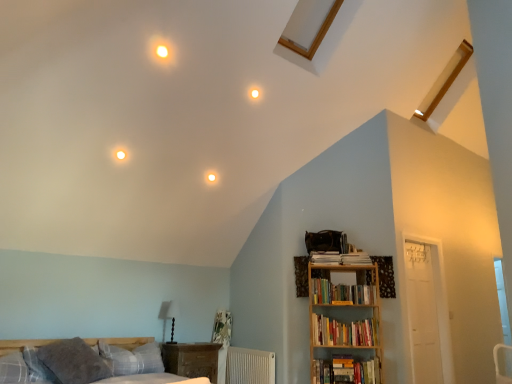
What do you see at coordinates (98, 366) in the screenshot? I see `plaid fabric bed at lower left` at bounding box center [98, 366].

Locate an element on the screen. Image resolution: width=512 pixels, height=384 pixels. matte white light bulb at upper center is located at coordinates (211, 177).

What do you see at coordinates (169, 315) in the screenshot?
I see `white matte table lamp at center` at bounding box center [169, 315].

What do you see at coordinates (344, 332) in the screenshot?
I see `hardcover books at right, marked as the second book in a top-to-bottom arrangement` at bounding box center [344, 332].

You are a GUI agent. You are given a task and a screenshot of the screen. Output one action in this format:
    pyautogui.click(x=<x>, y=<y>)
    Task: Click on the hardcover books at right, the third book viewed from the top
    This screenshot has width=512, height=384.
    Given the screenshot: What is the action you would take?
    coord(347,372)

Is white textured radiator at lower center to the left or to the right of gray soft pillow at lower left, the first pillow when ordered from right to left, in the image?

Clearly, white textured radiator at lower center is on the right of gray soft pillow at lower left, the first pillow when ordered from right to left, in the image.

Can you confirm if white textured radiator at lower center is shorter than gray soft pillow at lower left, the first pillow when ordered from right to left?

Incorrect, the height of white textured radiator at lower center does not fall short of that of gray soft pillow at lower left, the first pillow when ordered from right to left.

Is point (230, 359) closer to viewer compared to point (56, 343)?

No, (230, 359) is further to viewer.

Considering the sizes of white textured radiator at lower center and gray soft pillow at lower left, the first pillow when ordered from right to left, in the image, is white textured radiator at lower center wider or thinner than gray soft pillow at lower left, the first pillow when ordered from right to left,?

Considering their sizes, white textured radiator at lower center looks slimmer than gray soft pillow at lower left, the first pillow when ordered from right to left.

Between white matte table lamp at center and hardcover books at right, marked as the second book in a top-to-bottom arrangement, which one has less height?

hardcover books at right, marked as the second book in a top-to-bottom arrangement, is shorter.

From a real-world perspective, relative to hardcover books at right, marked as the second book in a top-to-bottom arrangement, is white matte table lamp at center vertically above or below?

From a real-world perspective, white matte table lamp at center is physically above hardcover books at right, marked as the second book in a top-to-bottom arrangement.

Considering the sizes of white matte table lamp at center and hardcover books at right, marked as the second book in a top-to-bottom arrangement, in the image, is white matte table lamp at center wider or thinner than hardcover books at right, marked as the second book in a top-to-bottom arrangement,?

In the image, white matte table lamp at center appears to be more narrow than hardcover books at right, marked as the second book in a top-to-bottom arrangement.

From the image's perspective, which is below, hardcover books at right, the 1th book from the bottom, or white textured radiator at lower center?

From the image's view, white textured radiator at lower center is below.

Does hardcover books at right, the 1th book from the bottom, turn towards white textured radiator at lower center?

No, hardcover books at right, the 1th book from the bottom, is not facing towards white textured radiator at lower center.

Is hardcover books at right, the 1th book from the bottom, not inside white textured radiator at lower center?

Yes.

Is point (360, 364) farther from camera compared to point (257, 360)?

That is False.

Considering the sizes of objects plaid fabric bed at lower left and matte white light bulb at upper center in the image provided, who is wider, plaid fabric bed at lower left or matte white light bulb at upper center?

With larger width is plaid fabric bed at lower left.

Which is further, (140,354) or (211,177)?

The point (211,177) is behind.

Looking at this image, is matte white light bulb at upper center at the back of plaid fabric bed at lower left?

No, plaid fabric bed at lower left is not facing away from matte white light bulb at upper center.

Looking at this image, does plaid fabric bed at lower left appear on the right side of matte white light bulb at upper center?

No, plaid fabric bed at lower left is not to the right of matte white light bulb at upper center.

Consider the image. Does white matte table lamp at center have a lesser height compared to wooden bookshelf at right?

Correct, white matte table lamp at center is not as tall as wooden bookshelf at right.

Considering the positions of points (163, 341) and (368, 289), is point (163, 341) farther from camera compared to point (368, 289)?

No, (163, 341) is closer to viewer.

Consider the image. From the image's perspective, is white matte table lamp at center above wooden bookshelf at right?

No, from the image's perspective, white matte table lamp at center is not above wooden bookshelf at right.

Considering the positions of objects white matte table lamp at center and wooden bookshelf at right in the image provided, who is more to the right, white matte table lamp at center or wooden bookshelf at right?

wooden bookshelf at right.

Is matte white light bulb at upper center spatially inside white matte table lamp at center, or outside of it?

matte white light bulb at upper center cannot be found inside white matte table lamp at center.

How many degrees apart are the facing directions of matte white light bulb at upper center and white matte table lamp at center?

The angular difference between matte white light bulb at upper center and white matte table lamp at center is 0.0862 degrees.

Where is `lighting above the white matte table lamp at center (from a real-world perspective)`? The image size is (512, 384). lighting above the white matte table lamp at center (from a real-world perspective) is located at coordinates click(x=211, y=177).

Does matte white light bulb at upper center appear on the left side of white matte table lamp at center?

In fact, matte white light bulb at upper center is to the right of white matte table lamp at center.

From the image's perspective, which one is positioned higher, wooden bookshelf at right or matte white light bulb at upper center?

matte white light bulb at upper center appears higher in the image.

Is wooden bookshelf at right at the left side of matte white light bulb at upper center?

Incorrect, wooden bookshelf at right is not on the left side of matte white light bulb at upper center.

From a real-world perspective, which is physically above, wooden bookshelf at right or matte white light bulb at upper center?

matte white light bulb at upper center is physically above.

How different are the orientations of wooden bookshelf at right and matte white light bulb at upper center in degrees?

The angle between the facing direction of wooden bookshelf at right and the facing direction of matte white light bulb at upper center is 45.4 degrees.

In order to click on the 1st pillow in front of the white textured radiator at lower center in this screenshot , I will do `click(73, 361)`.

Where is `table lamp located behind the hardcover books at right, which is the 2th book in bottom-to-top order`? The width and height of the screenshot is (512, 384). table lamp located behind the hardcover books at right, which is the 2th book in bottom-to-top order is located at coordinates (169, 315).

Estimate the real-world distances between objects in this image. Which object is further from wooden bookshelf at right, white textured radiator at lower center or matte white light bulb at upper center?

matte white light bulb at upper center lies further to wooden bookshelf at right than the other object.

From the image, which object appears to be nearer to plaid fabric bed at lower left, matte white light bulb at upper center or white textured radiator at lower center?

white textured radiator at lower center lies closer to plaid fabric bed at lower left than the other object.

Considering their positions, is matte white light bulb at upper center positioned closer to wooden bookshelf at right than wooden nightstand at lower left?

wooden nightstand at lower left lies closer to wooden bookshelf at right than the other object.

Which object lies further to the anchor point plaid fabric pillow at lower left, which is the first pillow in left-to-right order, wooden bookshelf at right or hardcover books at upper right, the first book viewed from the top?

hardcover books at upper right, the first book viewed from the top.

Estimate the real-world distances between objects in this image. Which object is closer to white textured radiator at lower center, plaid fabric pillow at lower left, the second pillow viewed from the right, or wooden nightstand at lower left?

wooden nightstand at lower left lies closer to white textured radiator at lower center than the other object.

From the image, which object appears to be nearer to wooden nightstand at lower left, plaid fabric pillow at lower left, the second pillow viewed from the right, or plaid fabric bed at lower left?

plaid fabric bed at lower left.

When comparing their distances from matte white light bulb at upper center, does hardcover books at right, the third book viewed from the top, or hardcover books at upper right, which is the third book from bottom to top, seem further?

hardcover books at right, the third book viewed from the top, is further to matte white light bulb at upper center.

Which object lies nearer to the anchor point white matte table lamp at center, hardcover books at upper right, the first book viewed from the top, or wooden bookshelf at right?

Based on the image, hardcover books at upper right, the first book viewed from the top, appears to be nearer to white matte table lamp at center.

Where is `book located between plaid fabric bed at lower left and hardcover books at right, marked as the second book in a top-to-bottom arrangement, in the depth direction`? The width and height of the screenshot is (512, 384). book located between plaid fabric bed at lower left and hardcover books at right, marked as the second book in a top-to-bottom arrangement, in the depth direction is located at coordinates (347, 372).

The image size is (512, 384). I want to click on lighting between plaid fabric pillow at lower left, the second pillow viewed from the right, and hardcover books at right, the third book viewed from the top, in the horizontal direction, so click(x=211, y=177).

Where is `nightstand situated between plaid fabric pillow at lower left, which is the first pillow in left-to-right order, and hardcover books at right, the third book viewed from the top, from left to right`? The image size is (512, 384). nightstand situated between plaid fabric pillow at lower left, which is the first pillow in left-to-right order, and hardcover books at right, the third book viewed from the top, from left to right is located at coordinates (191, 359).

Where is `nightstand between gray soft pillow at lower left, the first pillow when ordered from right to left, and hardcover books at right, which is the 2th book in bottom-to-top order`? Image resolution: width=512 pixels, height=384 pixels. nightstand between gray soft pillow at lower left, the first pillow when ordered from right to left, and hardcover books at right, which is the 2th book in bottom-to-top order is located at coordinates (191, 359).